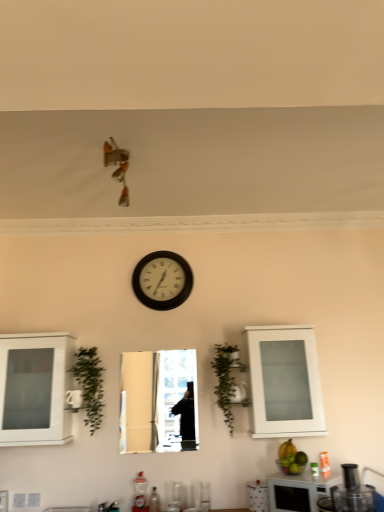
Question: Can you confirm if white matte cabinet at left, which ranks as the first cabinetry in left-to-right order, is thinner than green leafy plant at center, the first plant in the right-to-left sequence?

Choices:
 (A) yes
 (B) no

Answer: (B)

Question: Is green leafy plant at center, placed as the second plant when sorted from left to right, located within white matte cabinet at left, which ranks as the first cabinetry in left-to-right order?

Choices:
 (A) yes
 (B) no

Answer: (B)

Question: Is white matte cabinet at left, the 2th cabinetry when ordered from right to left, facing away from green leafy plant at center, the first plant in the right-to-left sequence?

Choices:
 (A) yes
 (B) no

Answer: (B)

Question: Is white matte cabinet at left, which ranks as the first cabinetry in left-to-right order, at the right side of green leafy plant at center, placed as the second plant when sorted from left to right?

Choices:
 (A) yes
 (B) no

Answer: (B)

Question: From a real-world perspective, is white matte cabinet at left, which ranks as the first cabinetry in left-to-right order, located beneath green leafy plant at center, placed as the second plant when sorted from left to right?

Choices:
 (A) no
 (B) yes

Answer: (A)

Question: Which is correct: yellow matte bananas at lower right is inside green leafy plant at left, the 1th plant when ordered from left to right, or outside of it?

Choices:
 (A) outside
 (B) inside

Answer: (A)

Question: In terms of width, does yellow matte bananas at lower right look wider or thinner when compared to green leafy plant at left, which is counted as the 2th plant, starting from the right?

Choices:
 (A) wide
 (B) thin

Answer: (B)

Question: Considering the positions of yellow matte bananas at lower right and green leafy plant at left, which is counted as the 2th plant, starting from the right, in the image, is yellow matte bananas at lower right taller or shorter than green leafy plant at left, which is counted as the 2th plant, starting from the right,?

Choices:
 (A) short
 (B) tall

Answer: (A)

Question: In terms of size, does yellow matte bananas at lower right appear bigger or smaller than green leafy plant at left, which is counted as the 2th plant, starting from the right?

Choices:
 (A) big
 (B) small

Answer: (B)

Question: Does point (162, 440) appear closer or farther from the camera than point (294, 450)?

Choices:
 (A) farther
 (B) closer

Answer: (A)

Question: From a real-world perspective, relative to yellow matte bananas at lower right, is metallic reflective mirror at center vertically above or below?

Choices:
 (A) below
 (B) above

Answer: (B)

Question: Is metallic reflective mirror at center taller or shorter than yellow matte bananas at lower right?

Choices:
 (A) short
 (B) tall

Answer: (B)

Question: From the image's perspective, relative to yellow matte bananas at lower right, is metallic reflective mirror at center above or below?

Choices:
 (A) below
 (B) above

Answer: (B)

Question: In terms of width, does black matte microwave at lower right, acting as the 1th appliance starting from the bottom, look wider or thinner when compared to black plastic food processor at lower right, acting as the 2th appliance starting from the back?

Choices:
 (A) thin
 (B) wide

Answer: (A)

Question: Is black matte microwave at lower right, acting as the 1th appliance starting from the bottom, situated inside black plastic food processor at lower right, which ranks as the first appliance in front-to-back order, or outside?

Choices:
 (A) inside
 (B) outside

Answer: (B)